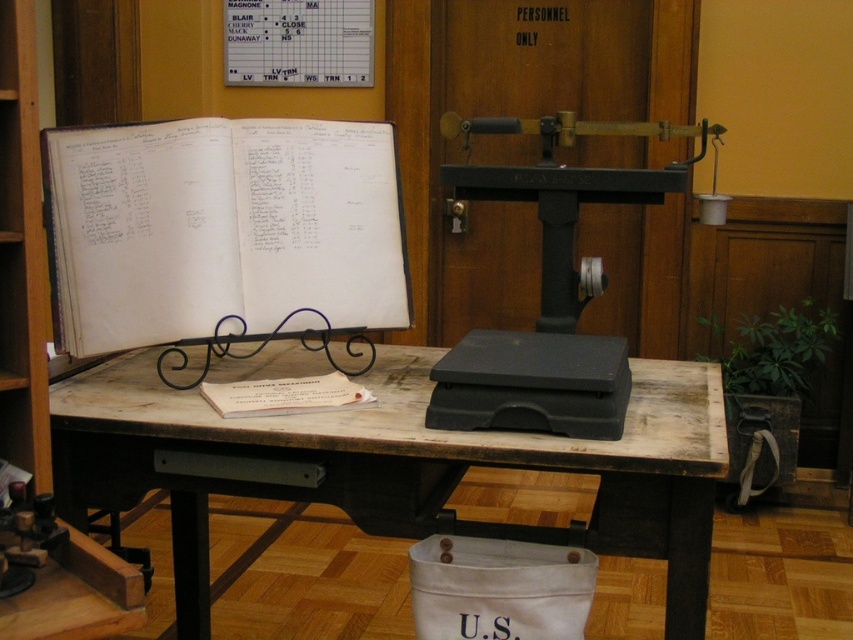
Is white paper book at center taller than wooden bookshelf at left?

No.

The height and width of the screenshot is (640, 853). I want to click on white paper book at center, so click(x=222, y=230).

Find the location of a particular element. The width and height of the screenshot is (853, 640). white paper book at center is located at coordinates (222, 230).

Does white paper book at center have a lesser width compared to white paper at center?

No, white paper book at center is not thinner than white paper at center.

Is white paper book at center taller than white paper at center?

Indeed, white paper book at center has a greater height compared to white paper at center.

Is point (376, 244) positioned after point (315, 394)?

That is True.

The height and width of the screenshot is (640, 853). I want to click on white paper book at center, so click(x=222, y=230).

How distant is wooden table at center from wooden bookshelf at left?

24.03 inches

Can you confirm if wooden table at center is shorter than wooden bookshelf at left?

Correct, wooden table at center is not as tall as wooden bookshelf at left.

In order to click on wooden table at center in this screenshot , I will do click(x=399, y=467).

The width and height of the screenshot is (853, 640). Identify the location of wooden table at center. (399, 467).